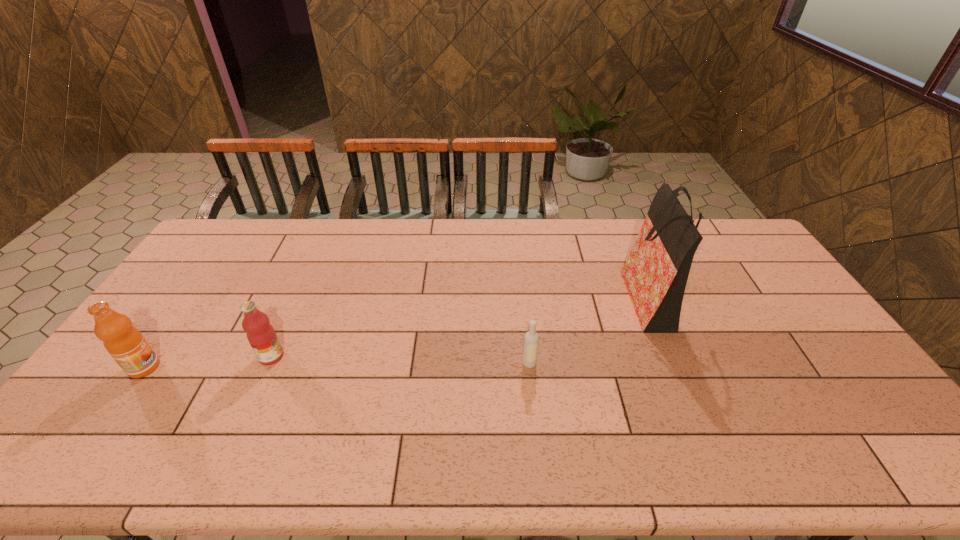
The width and height of the screenshot is (960, 540). Find the location of `the rightmost object`. the rightmost object is located at coordinates (656, 271).

Where is `shopping bag`? This screenshot has height=540, width=960. shopping bag is located at coordinates (656, 271).

The height and width of the screenshot is (540, 960). Find the location of `the leftmost object`. the leftmost object is located at coordinates (124, 342).

Find the location of `the second shortest object`. the second shortest object is located at coordinates (261, 335).

The image size is (960, 540). I want to click on the right fruit juice, so tap(261, 335).

The image size is (960, 540). Identify the location of the second object from right to left. (531, 340).

Where is `vodka`? vodka is located at coordinates (531, 340).

Where is `free space located on the front side of the rightmost object`? This screenshot has width=960, height=540. free space located on the front side of the rightmost object is located at coordinates (500, 295).

Locate an element on the screen. vacant space located on the front side of the rightmost object is located at coordinates (553, 295).

Image resolution: width=960 pixels, height=540 pixels. In order to click on vacant space located 0.400m on the front side of the rightmost object in this screenshot , I will do 500,295.